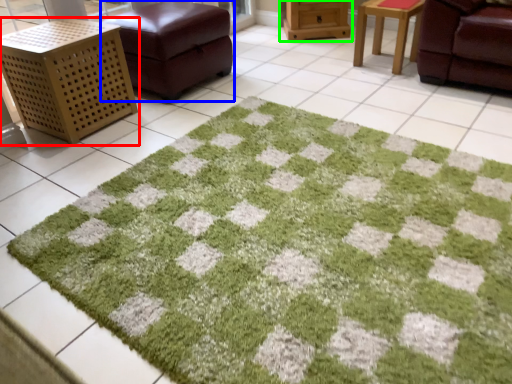
Question: Estimate the real-world distances between objects in this image. Which object is closer to furniture (highlighted by a red box), furniture (highlighted by a blue box) or furniture (highlighted by a green box)?

Choices:
 (A) furniture
 (B) furniture

Answer: (A)